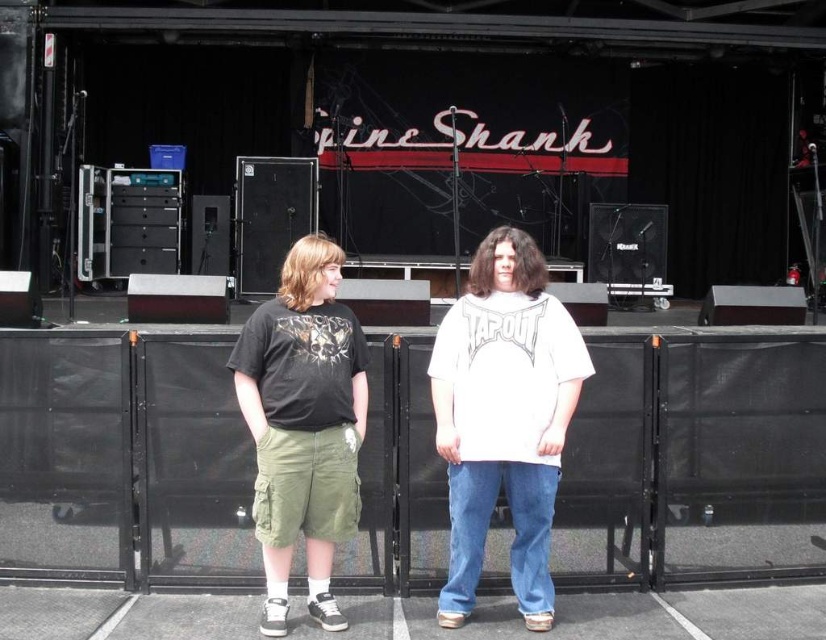
Is white cotton shirt at center thinner than dark gray matte t-shirt at center?

No.

Which is in front, point (439, 380) or point (264, 371)?

Point (264, 371) is more forward.

Where is `white cotton shirt at center`? white cotton shirt at center is located at coordinates (502, 419).